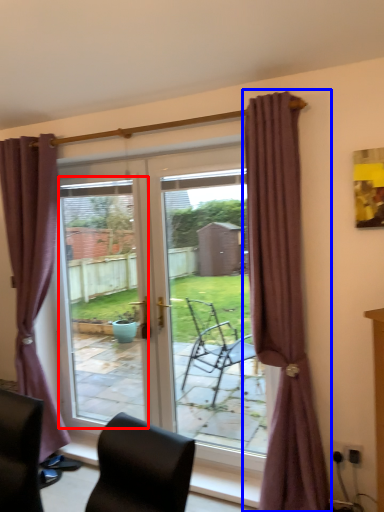
Question: Which of the following is the farthest to the observer, window screen (highlighted by a red box) or curtain (highlighted by a blue box)?

Choices:
 (A) window screen
 (B) curtain

Answer: (A)